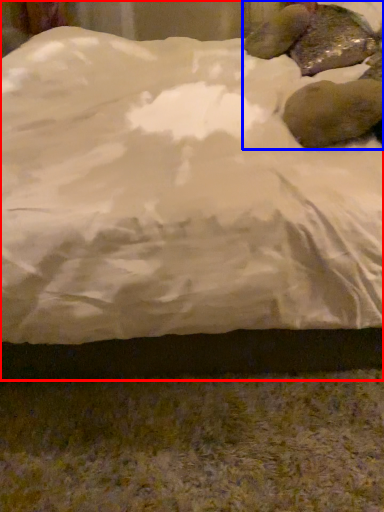
Question: Which point is closer to the camera, bed (highlighted by a red box) or animal (highlighted by a blue box)?

Choices:
 (A) bed
 (B) animal

Answer: (A)